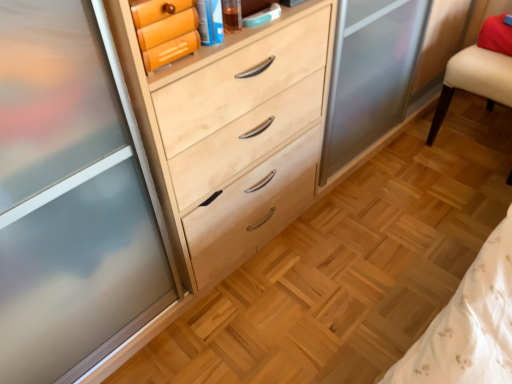
Locate an element on the screen. The image size is (512, 384). beige fabric chair at right is located at coordinates (480, 70).

The image size is (512, 384). What do you see at coordinates (480, 70) in the screenshot?
I see `beige fabric chair at right` at bounding box center [480, 70].

Identify the location of beige fabric chair at right. [480, 70].